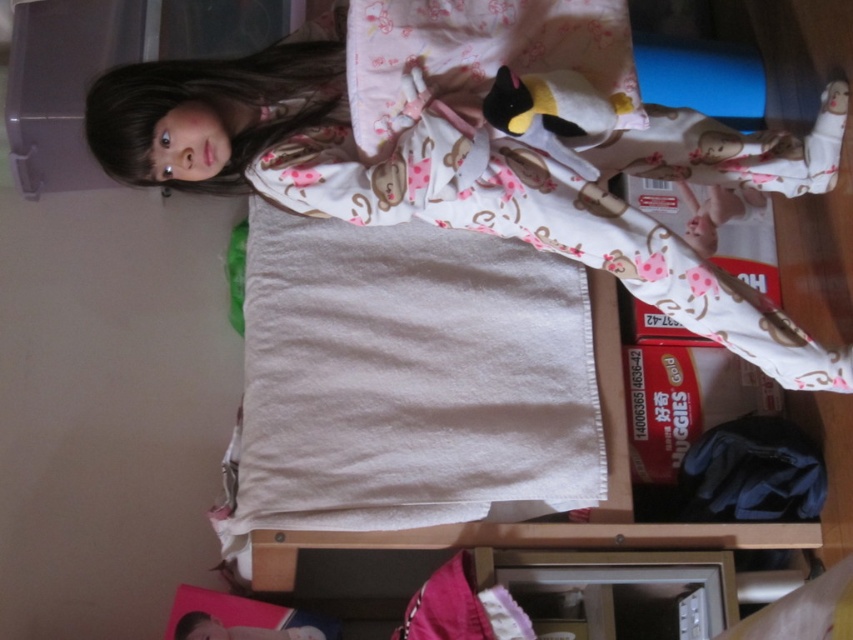
Question: Does white cotton pajamas at upper center have a lesser width compared to soft plush penguin at upper center?

Choices:
 (A) no
 (B) yes

Answer: (A)

Question: Which object is closer to the camera taking this photo?

Choices:
 (A) soft plush penguin at upper center
 (B) white cotton pajamas at upper center

Answer: (A)

Question: Which point appears closest to the camera in this image?

Choices:
 (A) (590, 122)
 (B) (824, 104)

Answer: (A)

Question: Considering the relative positions of white cotton pajamas at upper center and soft plush penguin at upper center in the image provided, where is white cotton pajamas at upper center located with respect to soft plush penguin at upper center?

Choices:
 (A) right
 (B) left

Answer: (B)

Question: Does white cotton pajamas at upper center have a greater width compared to soft plush penguin at upper center?

Choices:
 (A) no
 (B) yes

Answer: (B)

Question: Which object appears farthest from the camera in this image?

Choices:
 (A) soft plush penguin at upper center
 (B) white cotton pajamas at upper center

Answer: (B)